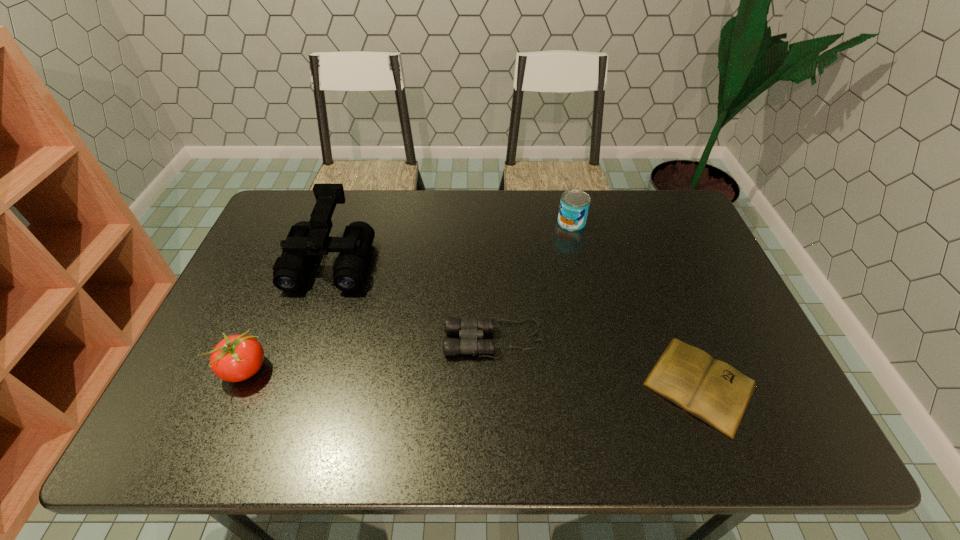
This screenshot has width=960, height=540. I want to click on vacant space located 0.130m on the front of the can, so click(x=580, y=259).

I want to click on free space located at the eyepiece of the nearer binoculars, so click(309, 339).

Image resolution: width=960 pixels, height=540 pixels. Find the location of `free space located 0.140m at the eyepiece of the nearer binoculars`. free space located 0.140m at the eyepiece of the nearer binoculars is located at coordinates point(391,339).

You are a GUI agent. You are given a task and a screenshot of the screen. Output one action in this format:
    pyautogui.click(x=<x>, y=<y>)
    Task: Click on the free region located at the eyepiece of the nearer binoculars
    
    Given the screenshot: What is the action you would take?
    (x=348, y=339)

You are a GUI agent. You are given a task and a screenshot of the screen. Output one action in this format:
    pyautogui.click(x=<x>, y=<y>)
    Task: Click on the free space located on the left of the book
    
    Given the screenshot: What is the action you would take?
    pyautogui.click(x=582, y=384)

Identify the location of binoculars that is at the far edge. (305, 239).

This screenshot has height=540, width=960. In order to click on can that is at the far edge in this screenshot , I will do `click(574, 205)`.

At what (x,y) coordinates should I click in order to perform the action: click on object that is at the near edge. Please return your answer as a coordinate pair (x, y). Looking at the image, I should click on (715, 392).

Image resolution: width=960 pixels, height=540 pixels. I want to click on binoculars that is at the left edge, so click(305, 239).

Locate an element on the screen. tomato located at the left edge is located at coordinates (236, 358).